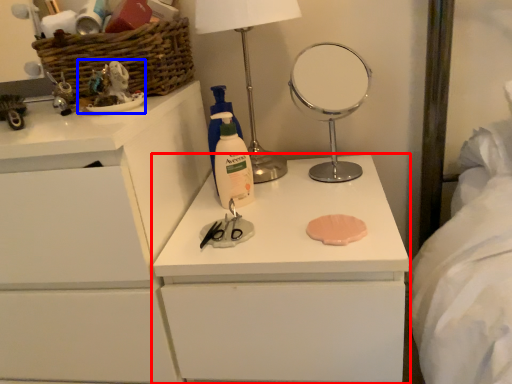
Question: Which point is closer to the camera, chest of drawers (highlighted by a red box) or toy (highlighted by a blue box)?

Choices:
 (A) chest of drawers
 (B) toy

Answer: (A)